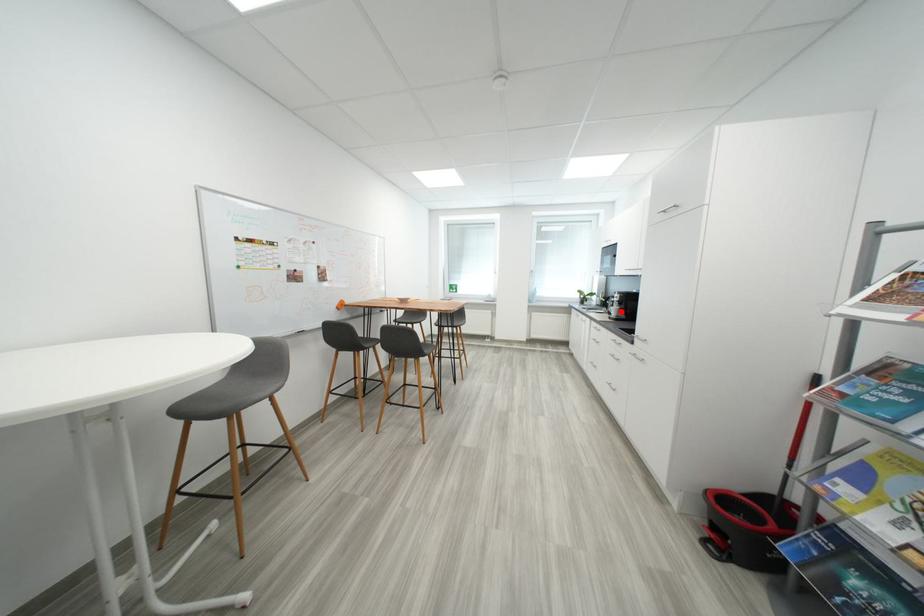
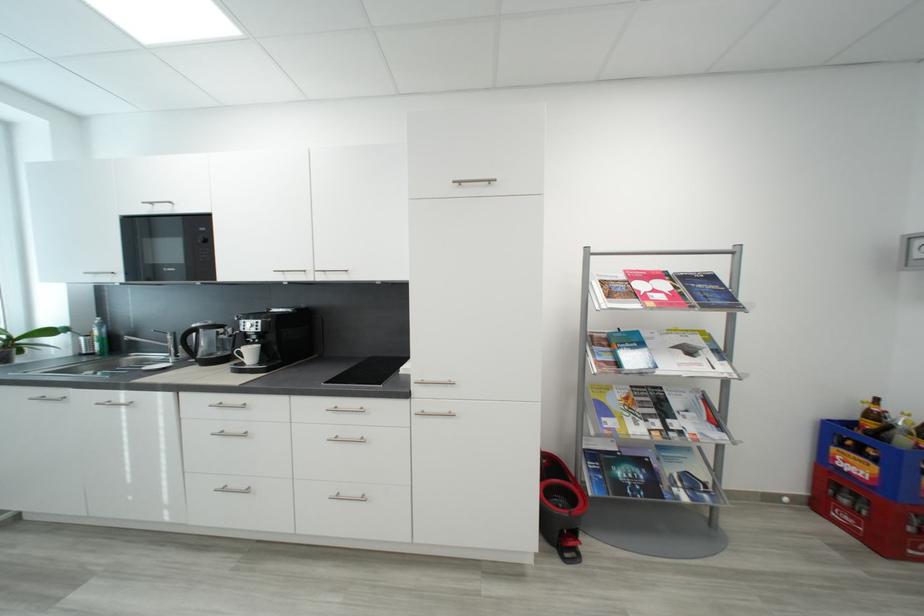
The point at the highlighted location is marked in the first image. Where is the corresponding point in the second image?

(257, 354)